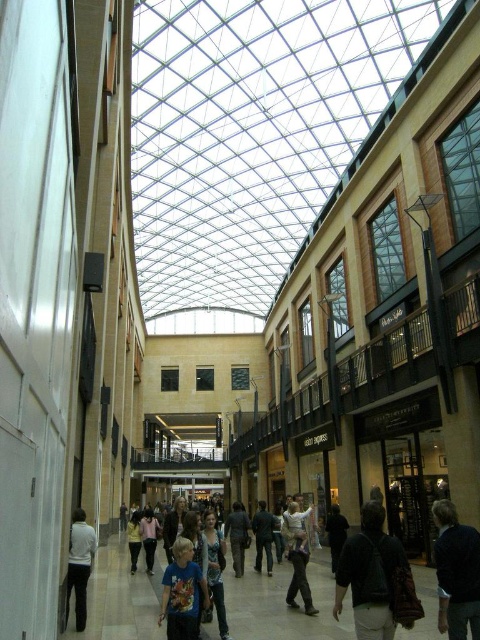
Who is more distant from viewer, (x=450, y=512) or (x=266, y=554)?

The point (x=266, y=554) is more distant.

What do you see at coordinates (456, 572) in the screenshot?
I see `dark blue jacket at center` at bounding box center [456, 572].

At what (x,y) coordinates should I click in order to perform the action: click on dark blue jacket at center. Please return your answer as a coordinate pair (x, y). Image resolution: width=480 pixels, height=640 pixels. Looking at the image, I should click on (456, 572).

Is dark blue jacket at center wider than blue t-shirt at center?

Indeed, dark blue jacket at center has a greater width compared to blue t-shirt at center.

Which is behind, point (455, 513) or point (180, 630)?

The point (455, 513) is behind.

Where is `dark blue jacket at center`? dark blue jacket at center is located at coordinates (456, 572).

Is dark gray backpack at lower right to the left of dark blue jeans at center from the viewer's perspective?

No, dark gray backpack at lower right is not to the left of dark blue jeans at center.

This screenshot has width=480, height=640. I want to click on dark gray backpack at lower right, so click(x=372, y=577).